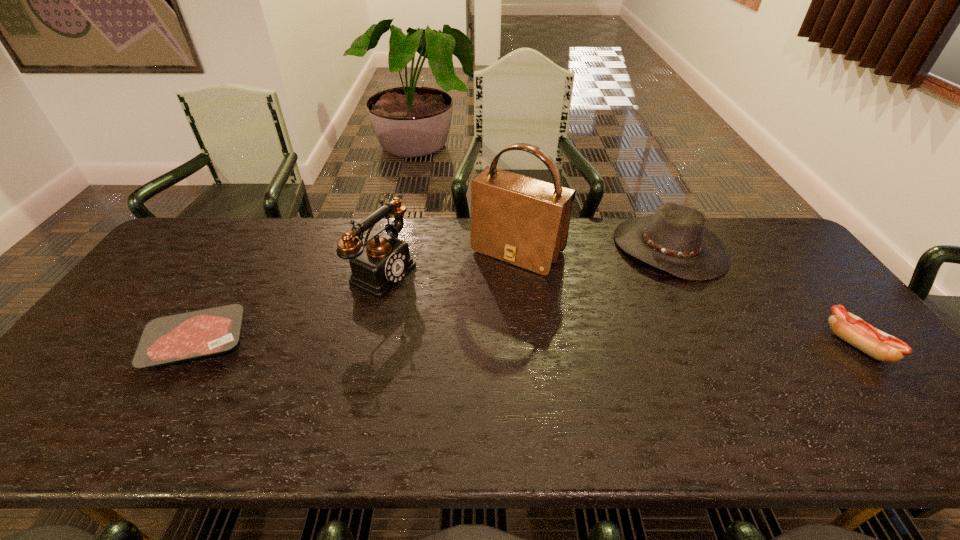
The height and width of the screenshot is (540, 960). I want to click on free space on the desktop that is between the steak and the sausage and is positioned on the front flap of the tallest object, so coord(444,343).

You are a GUI agent. You are given a task and a screenshot of the screen. Output one action in this format:
    pyautogui.click(x=<x>, y=<y>)
    Task: Click on the free space on the desktop that is between the shortest object and the sausage and is positioned on the front-facing side of the third shortest object
    The width and height of the screenshot is (960, 540).
    Given the screenshot: What is the action you would take?
    pyautogui.click(x=603, y=343)

At what (x,y) coordinates should I click in order to perform the action: click on vacant space on the desktop that is between the steak and the rightmost object and is positioned on the front of the fourth shortest object at the rotary dial. Please return your answer as a coordinate pair (x, y). Looking at the image, I should click on (551, 343).